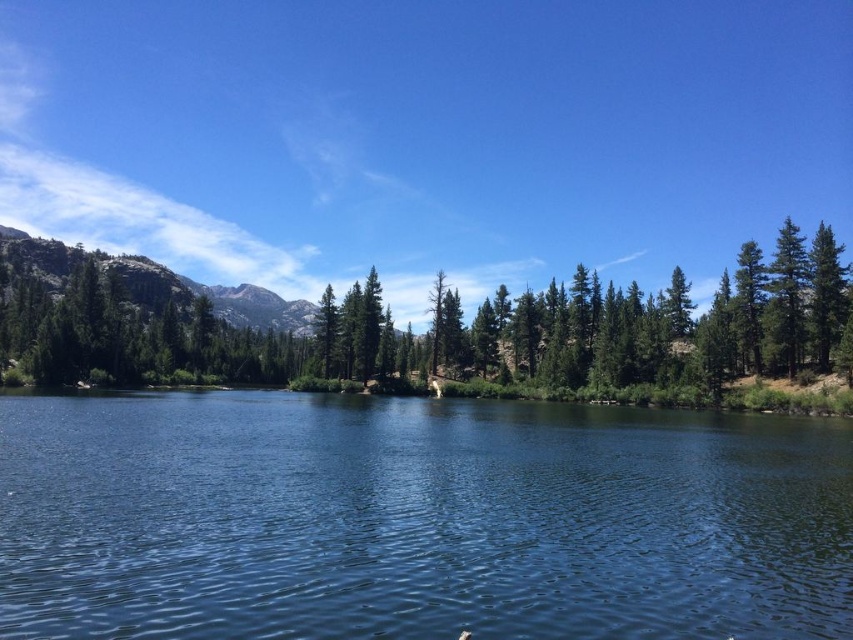
Does clear blue water at center lie behind rugged granite mountain at left?

No.

Is clear blue water at center thinner than rugged granite mountain at left?

Yes, clear blue water at center is thinner than rugged granite mountain at left.

Find the location of a particular element. This screenshot has width=853, height=640. clear blue water at center is located at coordinates (416, 518).